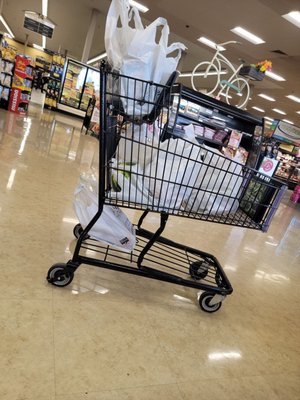
Identify the location of floor. This screenshot has width=300, height=400. (135, 308).